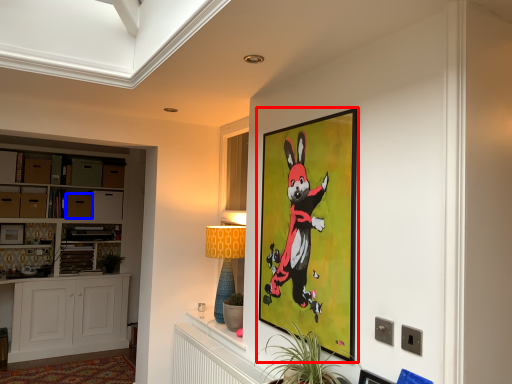
Question: Which point is closer to the camera, picture frame (highlighted by a red box) or drawer (highlighted by a blue box)?

Choices:
 (A) picture frame
 (B) drawer

Answer: (A)